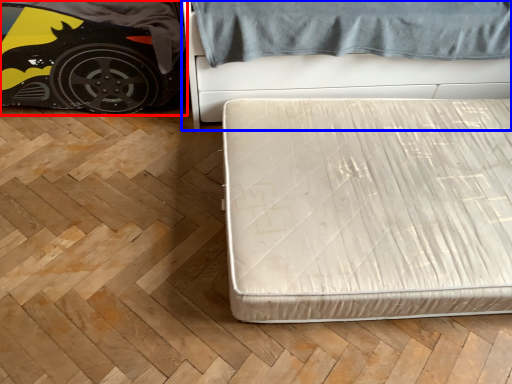
Question: Among these objects, which one is farthest to the camera, car (highlighted by a red box) or bed (highlighted by a blue box)?

Choices:
 (A) car
 (B) bed

Answer: (A)